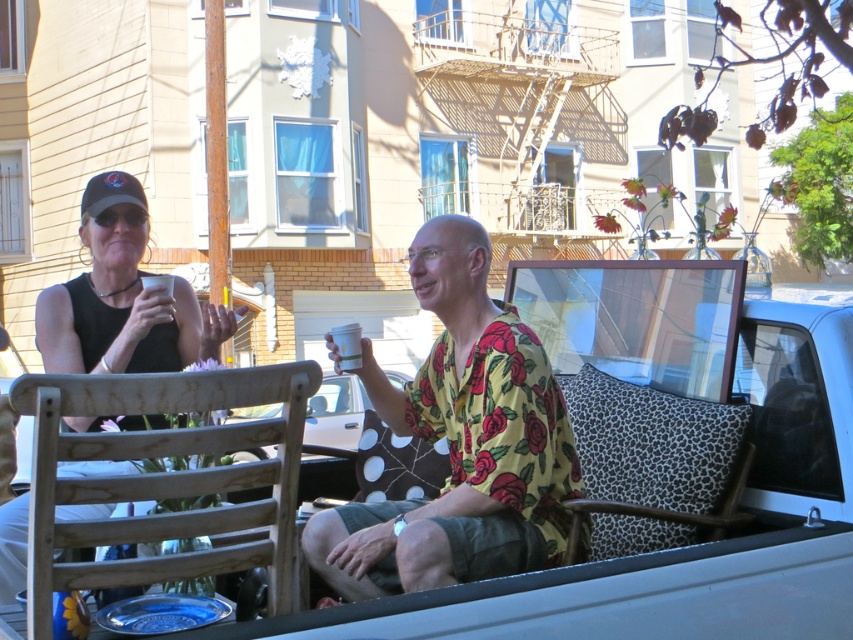
Can you confirm if wooden chair at center is taller than white matte cup at upper center?

Indeed, wooden chair at center has a greater height compared to white matte cup at upper center.

Is point (537, 417) closer to camera compared to point (357, 323)?

Yes, point (537, 417) is closer to viewer.

Locate an element on the screen. wooden chair at center is located at coordinates (460, 440).

Does yellow floral shirt at center appear over matte black tank top at left?

No.

Consider the image. Is yellow floral shirt at center closer to camera compared to matte black tank top at left?

That is False.

The height and width of the screenshot is (640, 853). In order to click on yellow floral shirt at center in this screenshot , I will do pyautogui.click(x=460, y=442).

Is yellow floral shirt at center further to camera compared to wooden chair at center?

No, it is not.

Does yellow floral shirt at center appear under wooden chair at center?

Actually, yellow floral shirt at center is above wooden chair at center.

Which is in front, point (573, 472) or point (346, 566)?

Positioned in front is point (346, 566).

Locate an element on the screen. The image size is (853, 640). yellow floral shirt at center is located at coordinates (460, 442).